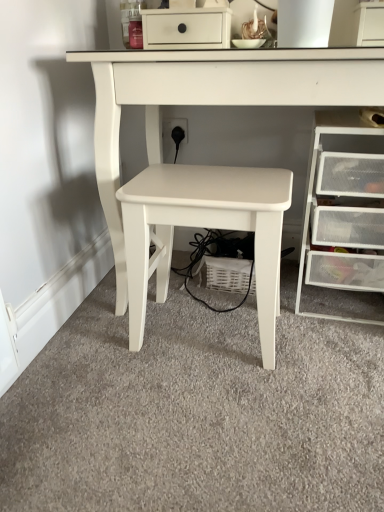
Question: Which direction should I rotate to look at white matte table at center, the 2th table positioned from the left, — up or down?

Choices:
 (A) up
 (B) down

Answer: (A)

Question: Does clear plastic drawers at right have a larger size compared to white matte table at center, the 2th table positioned from the left?

Choices:
 (A) yes
 (B) no

Answer: (B)

Question: From a real-world perspective, does clear plastic drawers at right stand above white matte table at center, the 1th table when ordered from right to left?

Choices:
 (A) yes
 (B) no

Answer: (B)

Question: From the image's perspective, is clear plastic drawers at right below white matte table at center, the 1th table when ordered from right to left?

Choices:
 (A) no
 (B) yes

Answer: (B)

Question: Would you say white matte table at center, the 1th table when ordered from right to left, is part of clear plastic drawers at right's contents?

Choices:
 (A) yes
 (B) no

Answer: (B)

Question: Can you confirm if clear plastic drawers at right is wider than white matte table at center, the 2th table positioned from the left?

Choices:
 (A) yes
 (B) no

Answer: (B)

Question: Is clear plastic drawers at right directly adjacent to white matte table at center, the 2th table positioned from the left?

Choices:
 (A) yes
 (B) no

Answer: (B)

Question: From a real-world perspective, does white matte table at center, the 2th table positioned from the left, stand above clear plastic drawers at right?

Choices:
 (A) no
 (B) yes

Answer: (B)

Question: Is white matte table at center, the 1th table when ordered from right to left, facing away from clear plastic drawers at right?

Choices:
 (A) yes
 (B) no

Answer: (A)

Question: Considering the relative positions of white matte table at center, the 1th table when ordered from right to left, and clear plastic drawers at right in the image provided, is white matte table at center, the 1th table when ordered from right to left, to the right of clear plastic drawers at right from the viewer's perspective?

Choices:
 (A) yes
 (B) no

Answer: (B)

Question: From the image's perspective, is white matte table at center, the 1th table when ordered from right to left, on clear plastic drawers at right?

Choices:
 (A) no
 (B) yes

Answer: (B)

Question: Is white matte table at center, the 1th table when ordered from right to left, thinner than clear plastic drawers at right?

Choices:
 (A) no
 (B) yes

Answer: (A)

Question: Is white matte table at center, the 1th table when ordered from right to left, positioned in front of clear plastic drawers at right?

Choices:
 (A) no
 (B) yes

Answer: (B)

Question: Is white matte table at center, positioned as the second table in right-to-left order, far from clear plastic drawers at right?

Choices:
 (A) yes
 (B) no

Answer: (B)